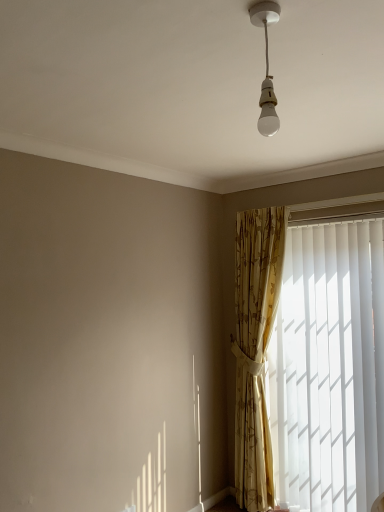
Where is `white vertical blinds at right`? The height and width of the screenshot is (512, 384). white vertical blinds at right is located at coordinates (329, 369).

What do you see at coordinates (329, 369) in the screenshot? I see `white vertical blinds at right` at bounding box center [329, 369].

The image size is (384, 512). What do you see at coordinates (266, 69) in the screenshot?
I see `white glossy bulb at upper center` at bounding box center [266, 69].

Locate an element on the screen. This screenshot has height=512, width=384. white glossy bulb at upper center is located at coordinates (266, 69).

Find the location of a particular element. The height and width of the screenshot is (512, 384). gold floral fabric curtain at right is located at coordinates (255, 348).

Is white vertical blinds at right beside gold floral fabric curtain at right?

No, white vertical blinds at right is not next to gold floral fabric curtain at right.

Is white vertical blinds at right facing away from gold floral fabric curtain at right?

No, white vertical blinds at right's orientation is not away from gold floral fabric curtain at right.

Considering the positions of objects white vertical blinds at right and gold floral fabric curtain at right in the image provided, who is behind, white vertical blinds at right or gold floral fabric curtain at right?

gold floral fabric curtain at right is behind.

From the image's perspective, is white vertical blinds at right on gold floral fabric curtain at right?

No, from the image's perspective, white vertical blinds at right is not above gold floral fabric curtain at right.

Is point (352, 410) less distant than point (265, 110)?

No, it is not.

Is white vertical blinds at right in contact with white glossy bulb at upper center?

white vertical blinds at right is not next to white glossy bulb at upper center, and they're not touching.

Does white vertical blinds at right come in front of white glossy bulb at upper center?

No, the depth of white vertical blinds at right is greater than that of white glossy bulb at upper center.

Visually, is white vertical blinds at right positioned to the left or to the right of white glossy bulb at upper center?

white vertical blinds at right is to the right of white glossy bulb at upper center.

Based on the photo, is gold floral fabric curtain at right oriented away from white vertical blinds at right?

No.

Which of these two, gold floral fabric curtain at right or white vertical blinds at right, is smaller?

gold floral fabric curtain at right.

Is white vertical blinds at right completely or partially inside gold floral fabric curtain at right?

Actually, white vertical blinds at right is outside gold floral fabric curtain at right.

Consider the image. Is white glossy bulb at upper center turned away from white vertical blinds at right?

No, white vertical blinds at right is not at the back of white glossy bulb at upper center.

Between white glossy bulb at upper center and white vertical blinds at right, which one has smaller width?

With smaller width is white vertical blinds at right.

Consider the image. Does white glossy bulb at upper center have a lesser height compared to white vertical blinds at right?

Correct, white glossy bulb at upper center is not as tall as white vertical blinds at right.

Image resolution: width=384 pixels, height=512 pixels. Find the location of `window behind the white glossy bulb at upper center`. window behind the white glossy bulb at upper center is located at coordinates (329, 369).

Is gold floral fabric curtain at right taller or shorter than white glossy bulb at upper center?

Clearly, gold floral fabric curtain at right is taller compared to white glossy bulb at upper center.

Could white glossy bulb at upper center be considered to be inside gold floral fabric curtain at right?

No, gold floral fabric curtain at right does not contain white glossy bulb at upper center.

Can you tell me how much gold floral fabric curtain at right and white glossy bulb at upper center differ in facing direction?

6.78 degrees.

Between gold floral fabric curtain at right and white glossy bulb at upper center, which one has smaller width?

With smaller width is white glossy bulb at upper center.

From the picture: Is white glossy bulb at upper center to the left or to the right of gold floral fabric curtain at right in the image?

From the image, it's evident that white glossy bulb at upper center is to the left of gold floral fabric curtain at right.

From a real-world perspective, which object rests below the other?

In real-world perspective, gold floral fabric curtain at right is lower.

Based on the photo, how many degrees apart are the facing directions of white glossy bulb at upper center and gold floral fabric curtain at right?

The angular difference between white glossy bulb at upper center and gold floral fabric curtain at right is 6.78 degrees.

Does point (266, 22) come closer to viewer compared to point (254, 270)?

Yes, it is.

The image size is (384, 512). I want to click on window that is under the gold floral fabric curtain at right (from a real-world perspective), so click(x=329, y=369).

This screenshot has height=512, width=384. I want to click on lamp that is on the left side of white vertical blinds at right, so click(266, 69).

From the image, which object appears to be nearer to gold floral fabric curtain at right, white vertical blinds at right or white glossy bulb at upper center?

white vertical blinds at right is closer to gold floral fabric curtain at right.

From the image, which object appears to be nearer to white vertical blinds at right, gold floral fabric curtain at right or white glossy bulb at upper center?

Based on the image, gold floral fabric curtain at right appears to be nearer to white vertical blinds at right.

Based on their spatial positions, is white vertical blinds at right or gold floral fabric curtain at right further from white glossy bulb at upper center?

gold floral fabric curtain at right.

From the image, which object appears to be nearer to gold floral fabric curtain at right, white glossy bulb at upper center or white vertical blinds at right?

The object closer to gold floral fabric curtain at right is white vertical blinds at right.

Looking at the image, which one is located further to white glossy bulb at upper center, gold floral fabric curtain at right or white vertical blinds at right?

Among the two, gold floral fabric curtain at right is located further to white glossy bulb at upper center.

Which object lies further to the anchor point white vertical blinds at right, white glossy bulb at upper center or gold floral fabric curtain at right?

white glossy bulb at upper center lies further to white vertical blinds at right than the other object.

Locate an element on the screen. window located between white glossy bulb at upper center and gold floral fabric curtain at right in the depth direction is located at coordinates (329, 369).